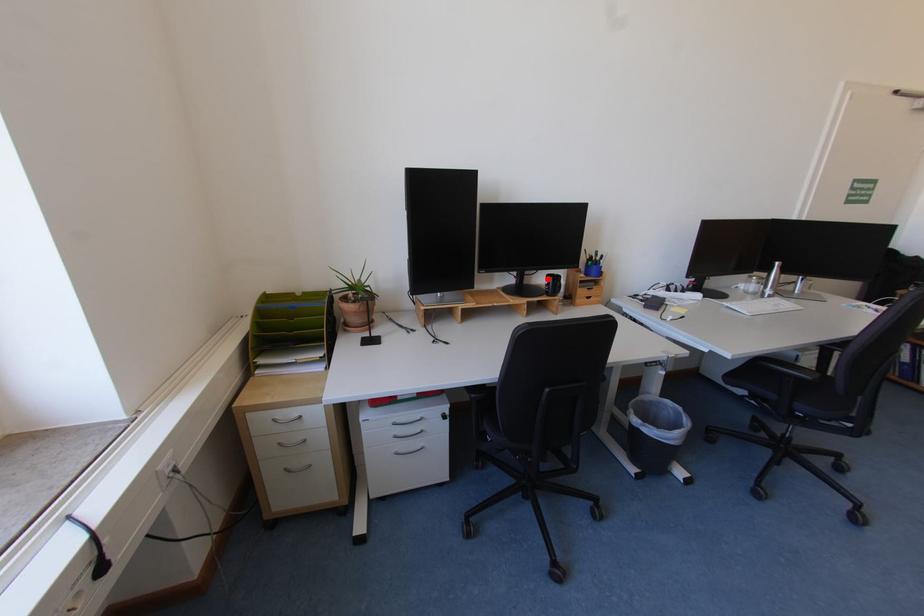
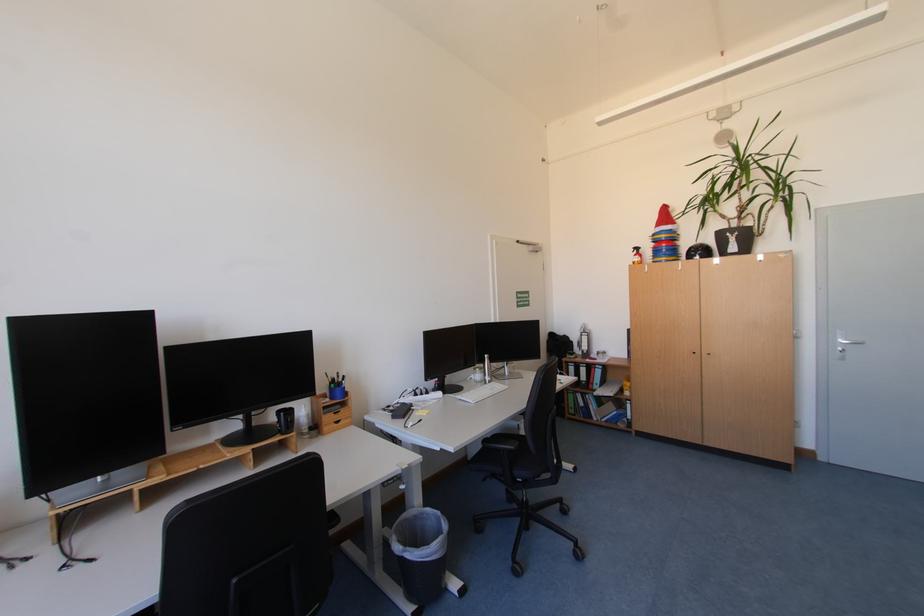
Locate, in the second image, the point that corresponds to the highlighted location in the first image.

(277, 416)